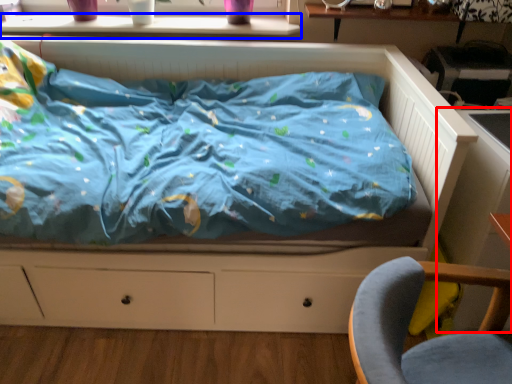
Question: Among these objects, which one is farthest to the camera, table (highlighted by a red box) or window sill (highlighted by a blue box)?

Choices:
 (A) table
 (B) window sill

Answer: (B)